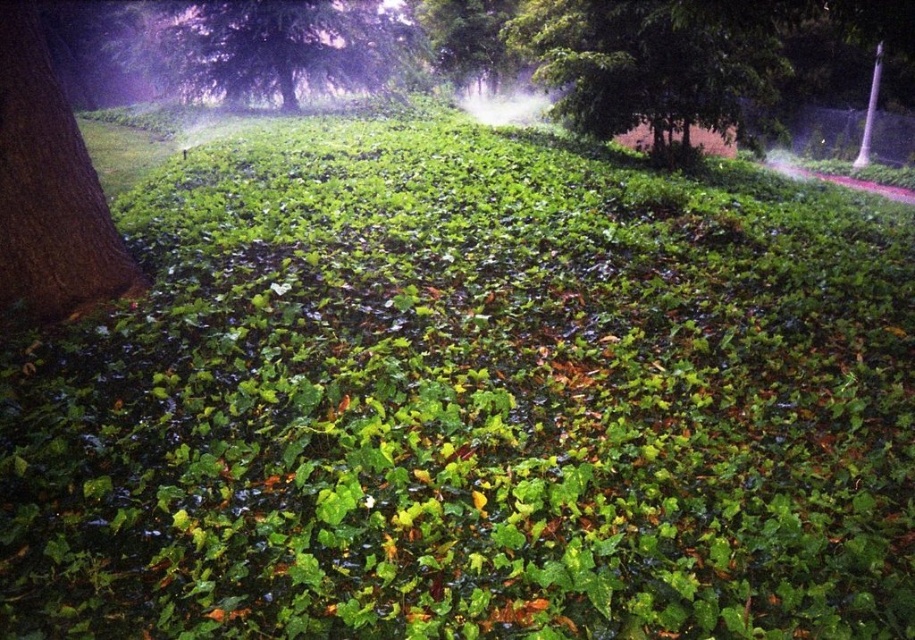
Can you confirm if brown rough bark tree at left is smaller than green leafy tree at upper left?

Yes, brown rough bark tree at left is smaller than green leafy tree at upper left.

Which is more to the left, brown rough bark tree at left or green leafy tree at upper left?

Positioned to the left is green leafy tree at upper left.

Who is more forward, (46,52) or (224,17)?

Positioned in front is point (46,52).

Locate an element on the screen. This screenshot has width=915, height=640. brown rough bark tree at left is located at coordinates (49, 189).

Who is positioned more to the right, green leafy tree at upper center or green leafy tree at upper left?

green leafy tree at upper center

Is point (757, 44) less distant than point (374, 61)?

That is True.

At what (x,y) coordinates should I click in order to perform the action: click on green leafy tree at upper center. Please return your answer as a coordinate pair (x, y). The height and width of the screenshot is (640, 915). Looking at the image, I should click on (649, 72).

Is green leafy tree at upper center wider than brown rough bark tree at left?

Yes.

Looking at this image, who is more forward, (528, 61) or (56, 316)?

Point (56, 316)

Describe the element at coordinates (649, 72) in the screenshot. I see `green leafy tree at upper center` at that location.

Locate an element on the screen. The image size is (915, 640). green leafy tree at upper center is located at coordinates pos(649,72).